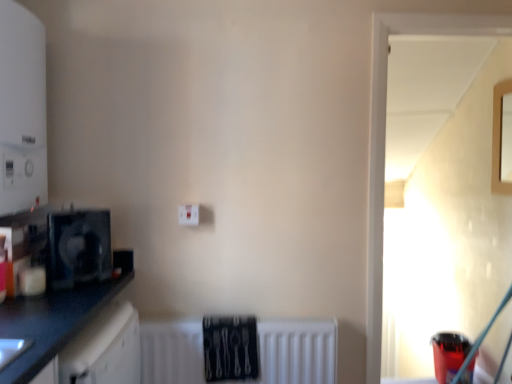
Image resolution: width=512 pixels, height=384 pixels. Identify the location of blank area beneath black plastic fan at left, the 1th appliance in the front-to-back sequence (from a real-world perspective). (79, 282).